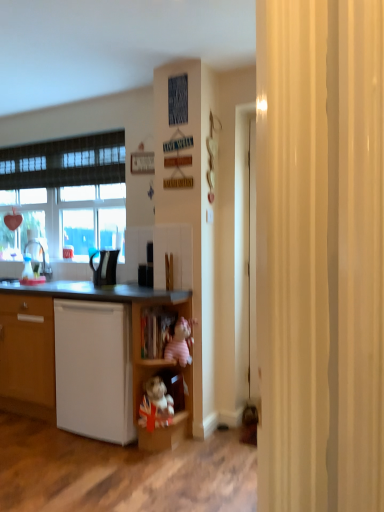
This screenshot has height=512, width=384. Describe the element at coordinates (167, 388) in the screenshot. I see `wooden shelf at center` at that location.

Locate an element on the screen. The width and height of the screenshot is (384, 512). wooden shelf at center is located at coordinates (x=167, y=388).

Locate an element on the screen. The image size is (384, 512). wooden cabinet at lower center, the 2th cabinet from the bottom is located at coordinates (165, 336).

The image size is (384, 512). In order to click on white matte cupboard at lower left in this screenshot , I will do `click(87, 357)`.

Find the location of `wooden plush toy at lower center, the 2th cabinet positioned from the top`. wooden plush toy at lower center, the 2th cabinet positioned from the top is located at coordinates (163, 396).

Measure the distance between point (157, 418) and camera.

The depth of point (157, 418) is 2.46 meters.

Measure the distance between point (113, 271) and camera.

The depth of point (113, 271) is 2.81 meters.

Image resolution: width=384 pixels, height=512 pixels. What do you see at coordinates (94, 369) in the screenshot?
I see `white matte dishwasher at lower left` at bounding box center [94, 369].

Where is `wooden shelf at center`? This screenshot has height=512, width=384. wooden shelf at center is located at coordinates (167, 388).

Could you tell me if pink plush toy at center is turned towards wooden shelf at center?

Yes, pink plush toy at center is facing wooden shelf at center.

From the image's perspective, is pink plush toy at center positioned above or below wooden shelf at center?

pink plush toy at center is situated higher than wooden shelf at center in the image.

Find the location of a particular element. The height and width of the screenshot is (512, 384). shelf that appears below the pink plush toy at center (from the image's perspective) is located at coordinates (167, 388).

From a real-world perspective, is wooden plush toy at lower center, which ranks as the 1th cabinet in bottom-to-top order, positioned above or below wooden cabinet at lower center, the 2th cabinet from the bottom?

In terms of real-world spatial position, wooden plush toy at lower center, which ranks as the 1th cabinet in bottom-to-top order, is below wooden cabinet at lower center, the 2th cabinet from the bottom.

Is wooden plush toy at lower center, the 2th cabinet positioned from the top, facing away from wooden cabinet at lower center, which is the first cabinet in top-to-bottom order?

No, wooden plush toy at lower center, the 2th cabinet positioned from the top, is not facing the opposite direction of wooden cabinet at lower center, which is the first cabinet in top-to-bottom order.

Who is taller, wooden plush toy at lower center, which ranks as the 1th cabinet in bottom-to-top order, or wooden cabinet at lower center, the 2th cabinet from the bottom?

Standing taller between the two is wooden cabinet at lower center, the 2th cabinet from the bottom.

Based on the photo, is the depth of wooden plush toy at lower center, the 2th cabinet positioned from the top, less than that of wooden cabinet at lower center, the 2th cabinet from the bottom?

That is True.

The image size is (384, 512). What are the coordinates of `the 2nd appliance counting from the left of the pink plush toy at center` in the screenshot? It's located at (105, 267).

Is pink plush toy at center looking in the opposite direction of black glossy kettle at center, which appears as the second appliance when viewed from the right?

No, pink plush toy at center is not facing the opposite direction of black glossy kettle at center, which appears as the second appliance when viewed from the right.

Is pink plush toy at center directly adjacent to black glossy kettle at center, which appears as the second appliance when viewed from the right?

No, pink plush toy at center is not making contact with black glossy kettle at center, which appears as the second appliance when viewed from the right.

Which is correct: pink plush toy at center is inside black glossy kettle at center, which appears as the second appliance when viewed from the right, or outside of it?

pink plush toy at center is not inside black glossy kettle at center, which appears as the second appliance when viewed from the right, it's outside.

Based on the photo, from a real-world perspective, which is physically above, black plastic kettle at center, the first appliance from the right, or white matte cupboard at lower left?

black plastic kettle at center, the first appliance from the right, is physically above.

In the scene shown: Is white matte cupboard at lower left completely or partially inside black plastic kettle at center, the 2th appliance in the left-to-right sequence?

That's incorrect, white matte cupboard at lower left is not inside black plastic kettle at center, the 2th appliance in the left-to-right sequence.

Considering the positions of objects black plastic kettle at center, the first appliance from the right, and white matte cupboard at lower left in the image provided, who is more to the right, black plastic kettle at center, the first appliance from the right, or white matte cupboard at lower left?

black plastic kettle at center, the first appliance from the right.

From a real-world perspective, is white matte cupboard at lower left physically below wooden cabinet at lower center, the 2th cabinet from the bottom?

Yes, from a real-world perspective, white matte cupboard at lower left is under wooden cabinet at lower center, the 2th cabinet from the bottom.

Would you say white matte cupboard at lower left is outside wooden cabinet at lower center, which is the first cabinet in top-to-bottom order?

That's correct, white matte cupboard at lower left is outside of wooden cabinet at lower center, which is the first cabinet in top-to-bottom order.

Is white matte cupboard at lower left bigger than wooden cabinet at lower center, which is the first cabinet in top-to-bottom order?

Yes, white matte cupboard at lower left is bigger than wooden cabinet at lower center, which is the first cabinet in top-to-bottom order.

From the image's perspective, would you say white matte cupboard at lower left is positioned over wooden cabinet at lower center, the 2th cabinet from the bottom?

No, from the image's perspective, white matte cupboard at lower left is not over wooden cabinet at lower center, the 2th cabinet from the bottom.

Does point (119, 434) appear closer or farther from the camera than point (149, 273)?

Point (119, 434) is positioned closer to the camera compared to point (149, 273).

From the picture: From the image's perspective, which one is positioned lower, white matte cupboard at lower left or black plastic kettle at center, the first appliance from the right?

white matte cupboard at lower left appears lower in the image.

Considering the sizes of white matte cupboard at lower left and black plastic kettle at center, the first appliance from the right, in the image, is white matte cupboard at lower left taller or shorter than black plastic kettle at center, the first appliance from the right,?

white matte cupboard at lower left is taller than black plastic kettle at center, the first appliance from the right.

Consider the image. Would you say white matte dishwasher at lower left is inside or outside wooden plush toy at lower center, the 2th cabinet positioned from the top?

white matte dishwasher at lower left is located beyond the bounds of wooden plush toy at lower center, the 2th cabinet positioned from the top.

Relative to wooden plush toy at lower center, the 2th cabinet positioned from the top, is white matte dishwasher at lower left in front or behind?

white matte dishwasher at lower left is positioned farther from the viewer than wooden plush toy at lower center, the 2th cabinet positioned from the top.

Considering the positions of objects white matte dishwasher at lower left and wooden plush toy at lower center, which ranks as the 1th cabinet in bottom-to-top order, in the image provided, who is more to the left, white matte dishwasher at lower left or wooden plush toy at lower center, which ranks as the 1th cabinet in bottom-to-top order,?

white matte dishwasher at lower left is more to the left.

What's the angular difference between white matte dishwasher at lower left and wooden plush toy at lower center, which ranks as the 1th cabinet in bottom-to-top order,'s facing directions?

The angle between the facing direction of white matte dishwasher at lower left and the facing direction of wooden plush toy at lower center, which ranks as the 1th cabinet in bottom-to-top order, is 0.576 degrees.

Locate an element on the screen. This screenshot has width=384, height=512. toy located above the wooden shelf at center (from a real-world perspective) is located at coordinates (180, 343).

Where is `cabinet above the wooden plush toy at lower center, which ranks as the 1th cabinet in bottom-to-top order (from the image's perspective)`? cabinet above the wooden plush toy at lower center, which ranks as the 1th cabinet in bottom-to-top order (from the image's perspective) is located at coordinates click(165, 336).

Which object lies nearer to the anchor point wooden shelf at center, white matte cupboard at lower left or wooden cabinet at lower center, the 2th cabinet from the bottom?

wooden cabinet at lower center, the 2th cabinet from the bottom, is positioned closer to the anchor wooden shelf at center.

Which object lies nearer to the anchor point wooden shelf at center, wooden plush toy at lower center, which ranks as the 1th cabinet in bottom-to-top order, or black glossy kettle at center, the first appliance viewed from the left?

wooden plush toy at lower center, which ranks as the 1th cabinet in bottom-to-top order.

Considering their positions, is wooden cabinet at lower center, which is the first cabinet in top-to-bottom order, positioned further to black glossy kettle at center, which appears as the second appliance when viewed from the right, than white matte dishwasher at lower left?

white matte dishwasher at lower left.

Which object lies further to the anchor point wooden cabinet at lower center, the 2th cabinet from the bottom, pink plush toy at center or white matte dishwasher at lower left?

white matte dishwasher at lower left lies further to wooden cabinet at lower center, the 2th cabinet from the bottom, than the other object.

Estimate the real-world distances between objects in this image. Which object is further from wooden plush toy at lower center, the 2th cabinet positioned from the top, white matte cupboard at lower left or black plastic kettle at center, the 2th appliance in the left-to-right sequence?

The object further to wooden plush toy at lower center, the 2th cabinet positioned from the top, is black plastic kettle at center, the 2th appliance in the left-to-right sequence.

From the picture: Estimate the real-world distances between objects in this image. Which object is further from white matte cupboard at lower left, wooden shelf at center or white matte dishwasher at lower left?

wooden shelf at center.

Considering their positions, is white matte cupboard at lower left positioned further to white matte dishwasher at lower left than wooden plush toy at lower center, the 2th cabinet positioned from the top?

wooden plush toy at lower center, the 2th cabinet positioned from the top, is positioned further to the anchor white matte dishwasher at lower left.

Estimate the real-world distances between objects in this image. Which object is further from pink plush toy at center, white matte dishwasher at lower left or black plastic kettle at center, the first appliance from the right?

white matte dishwasher at lower left.

Where is `cupboard between white matte dishwasher at lower left and pink plush toy at center`? This screenshot has height=512, width=384. cupboard between white matte dishwasher at lower left and pink plush toy at center is located at coordinates (87, 357).

Locate an element on the screen. Image resolution: width=384 pixels, height=512 pixels. cupboard between black plastic kettle at center, the first appliance from the right, and white matte dishwasher at lower left from top to bottom is located at coordinates (87, 357).

The height and width of the screenshot is (512, 384). In order to click on appliance located between black glossy kettle at center, which appears as the second appliance when viewed from the right, and pink plush toy at center in the left-right direction in this screenshot , I will do `click(145, 275)`.

At what (x,y) coordinates should I click in order to perform the action: click on toy between wooden shelf at center and black plastic kettle at center, the 2th appliance in the left-to-right sequence, from front to back. Please return your answer as a coordinate pair (x, y). This screenshot has height=512, width=384. Looking at the image, I should click on (180, 343).